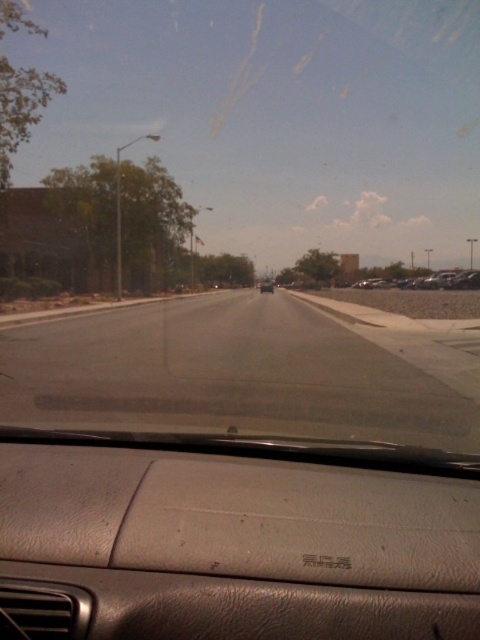
Question: Among these points, which one is nearest to the camera?

Choices:
 (A) (287, 42)
 (B) (267, 284)
 (C) (372, 280)

Answer: (B)

Question: Does metallic silver car at right appear on the right side of matte black sedan at center?

Choices:
 (A) no
 (B) yes

Answer: (B)

Question: Which of the following is the closest to the observer?

Choices:
 (A) (267, 282)
 (B) (169, 20)

Answer: (B)

Question: Is metallic silver car at right to the left of matte black sedan at center from the viewer's perspective?

Choices:
 (A) no
 (B) yes

Answer: (A)

Question: Is transparent glass windshield at center below metallic silver car at right?

Choices:
 (A) yes
 (B) no

Answer: (B)

Question: Which object is the farthest from the matte black sedan at center?

Choices:
 (A) metallic silver car at right
 (B) transparent glass windshield at center

Answer: (B)